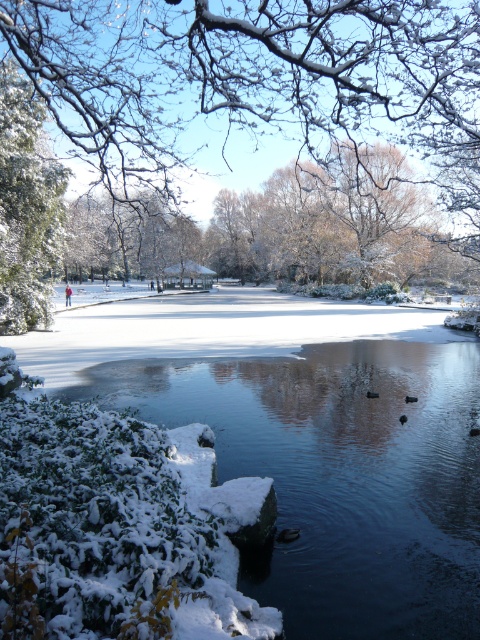
Question: Is snow-covered branches at upper center below green matte tree at upper left?

Choices:
 (A) no
 (B) yes

Answer: (A)

Question: Is snow-covered branches at upper center wider than green matte tree at upper left?

Choices:
 (A) yes
 (B) no

Answer: (A)

Question: Is snow-covered branches at upper center above green matte tree at upper left?

Choices:
 (A) yes
 (B) no

Answer: (A)

Question: Which object is closer to the camera taking this photo?

Choices:
 (A) green matte tree at upper left
 (B) snow-covered branches at upper center

Answer: (B)

Question: Which point appears farthest from the camera in this image?

Choices:
 (A) (375, 38)
 (B) (43, 113)

Answer: (B)

Question: Which point appears closest to the camera in this image?

Choices:
 (A) (147, 125)
 (B) (41, 173)

Answer: (B)